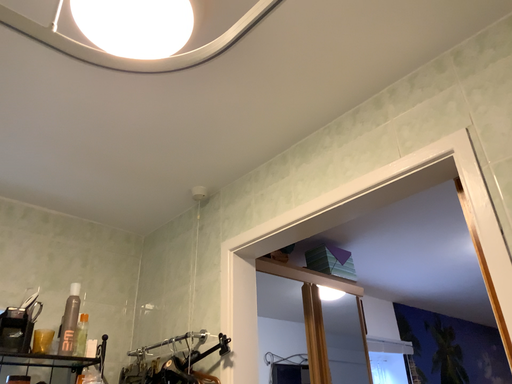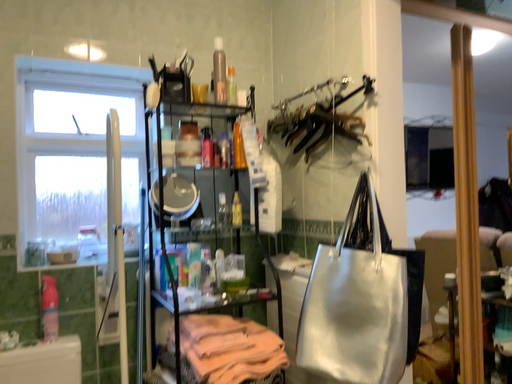
Question: Which way did the camera rotate in the video?

Choices:
 (A) rotated downward
 (B) rotated upward

Answer: (A)